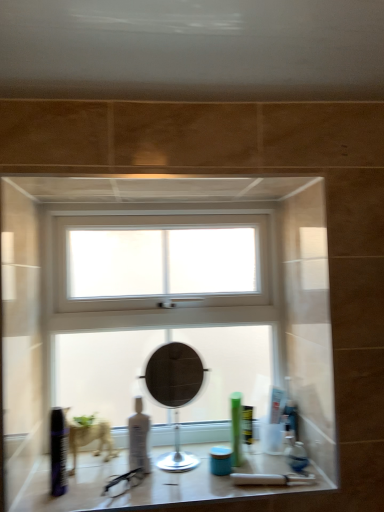
At what (x,y) coordinates should I click in order to perform the action: click on blank space situated above matte glass counter top at center (from a real-world perspective). Please return your answer as a coordinate pair (x, y). Looking at the image, I should click on (156, 475).